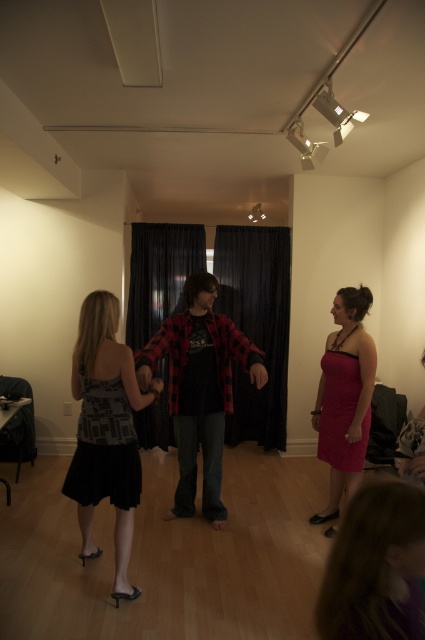
You are a photographer at an event and need to capture a photo of the red plaid shirt at center and the matte pink dress at right. The camera you are using has a minimum focus distance of 30 inches. Will you be able to take a clear photo of both subjects without moving the camera or the subjects?

The red plaid shirt at center is 29.33 inches from the matte pink dress at right, which is less than the camera minimum focus distance of 30 inches. Therefore, you will not be able to take a clear photo of both subjects without adjusting the camera or moving the subjects.